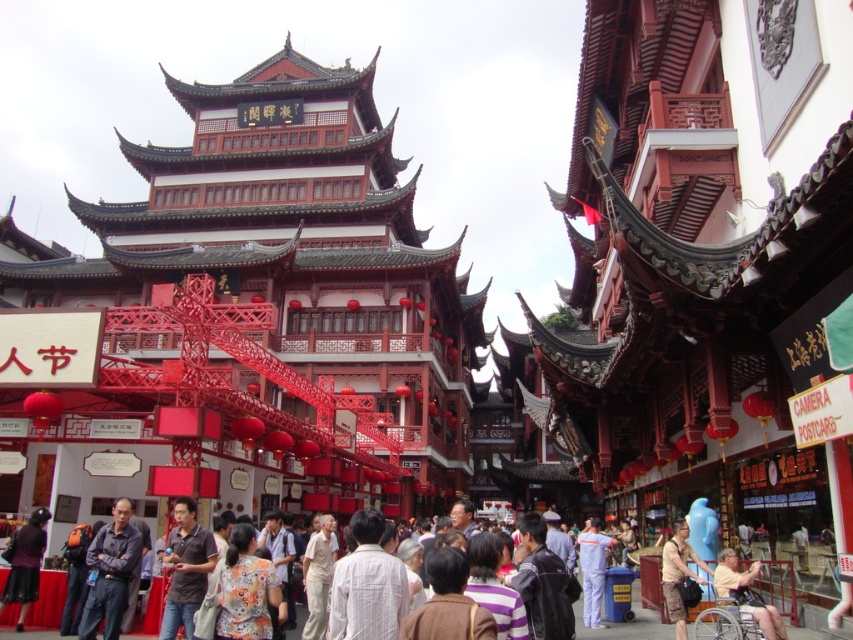
You are a tourist standing in the marketplace and see both the leather jacket at center and the striped cotton shirt at center. Which item is closer to you?

The leather jacket at center is closer to you because it is further to the viewer than the striped cotton shirt at center.

You are a tourist shopping in this marketplace and see both the leather jacket at center and the striped cotton shirt at center displayed on a rack. Which one is taller?

The leather jacket at center is much taller than the striped cotton shirt at center.

You are a photographer standing in the marketplace. You want to take a photo that includes both the dark blue shirt at center and the matte black dress at lower left. Which clothing item will appear smaller in the final photo?

The dark blue shirt at center will appear smaller in the final photo because it has a smaller size compared to the matte black dress at lower left.